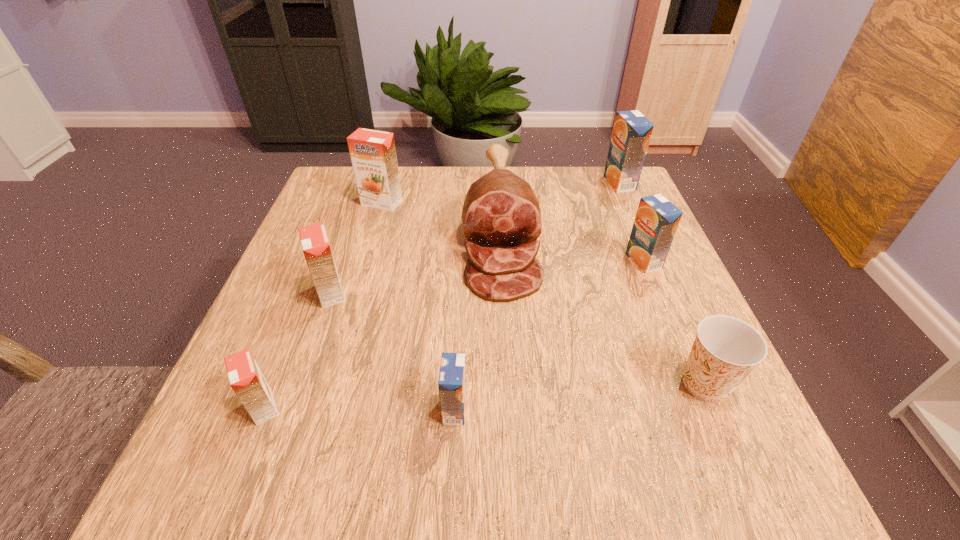
The width and height of the screenshot is (960, 540). Find the location of `object identified as the closest to the second nearest blue orange_juice`. object identified as the closest to the second nearest blue orange_juice is located at coordinates (501, 213).

Locate which orange_juice ranks third in proximity to the nearest blue orange_juice. Please provide its 2D coordinates. Your answer should be formatted as a tuple, i.e. [(x, y)], where the tuple contains the x and y coordinates of a point satisfying the conditions above.

[(657, 219)]

Identify which orange_juice is located as the fourth nearest to the second nearest blue orange_juice. Please provide its 2D coordinates. Your answer should be formatted as a tuple, i.e. [(x, y)], where the tuple contains the x and y coordinates of a point satisfying the conditions above.

[(315, 244)]

In order to click on blue orange_juice that can be found as the second closest to the fourth farthest orange_juice in this screenshot , I will do `click(657, 219)`.

Find the location of a particular element. This screenshot has height=540, width=960. the second closest blue orange_juice to the Dixie cup is located at coordinates (452, 377).

The width and height of the screenshot is (960, 540). In order to click on the second closest orange orange juice relative to the orange Dixie cup in this screenshot , I will do `click(246, 379)`.

Identify which orange orange juice is the nearest to the smallest orange orange juice. Please provide its 2D coordinates. Your answer should be formatted as a tuple, i.e. [(x, y)], where the tuple contains the x and y coordinates of a point satisfying the conditions above.

[(315, 244)]

Locate an element on the screen. The height and width of the screenshot is (540, 960). vacant space that satisfies the following two spatial constraints: 1. on the front side of the leftmost blue orange_juice; 2. on the right side of the second farthest orange orange juice is located at coordinates (291, 409).

Identify the location of blank area in the image that satisfies the following two spatial constraints: 1. on the back side of the nearest orange orange juice; 2. on the left side of the fourth farthest orange_juice. This screenshot has height=540, width=960. (309, 293).

Locate an element on the screen. This screenshot has width=960, height=540. vacant space that satisfies the following two spatial constraints: 1. on the front side of the Dixie cup; 2. on the right side of the second smallest blue orange_juice is located at coordinates (694, 383).